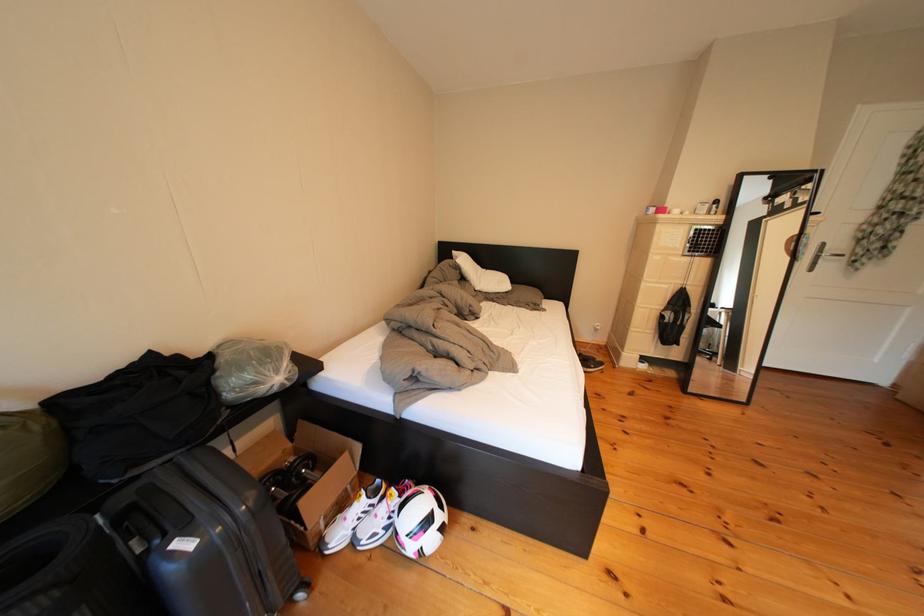
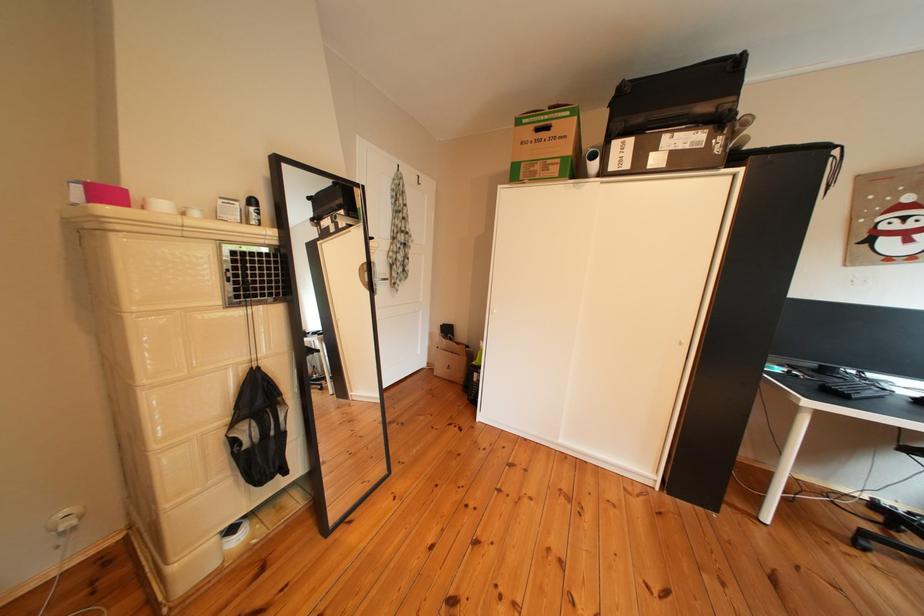
Question: I am providing you with two images of the same scene from different viewpoints. After the viewpoint changes to image2, which objects are now occluded?

Choices:
 (A) black mesh bag
 (B) metallic door handle
 (C) black product box
 (D) none of these

Answer: (D)